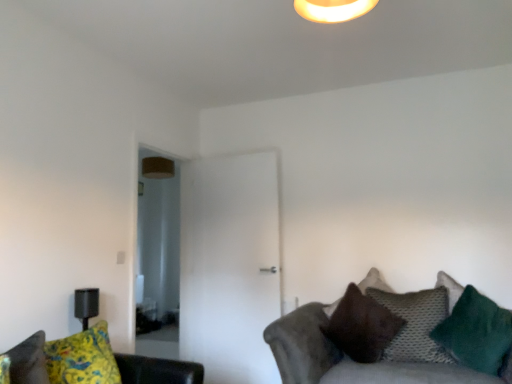
Question: Looking at their shapes, would you say textured gray couch at lower right, the first studio couch viewed from the right, is wider or thinner than yellow fabric couch at lower left, marked as the 2th studio couch in a right-to-left arrangement?

Choices:
 (A) thin
 (B) wide

Answer: (B)

Question: Would you say textured gray couch at lower right, the first studio couch viewed from the right, is to the left or to the right of yellow fabric couch at lower left, which is the first studio couch in left-to-right order, in the picture?

Choices:
 (A) right
 (B) left

Answer: (A)

Question: Which is farther from the textured gray couch at lower right, the first studio couch viewed from the right?

Choices:
 (A) knitted gray pillow at lower right, which appears as the second pillow when viewed from the back
 (B) yellow fabric couch at lower left, marked as the 2th studio couch in a right-to-left arrangement
 (C) green fuzzy pillow at right, the 1th pillow viewed from the front
 (D) brown suede pillow at lower right, placed as the 3th pillow when sorted from front to back

Answer: (B)

Question: Which object is the farthest from the brown suede pillow at lower right, which is counted as the 1th pillow, starting from the back?

Choices:
 (A) green fuzzy pillow at right, acting as the third pillow starting from the back
 (B) textured gray couch at lower right, which is the second studio couch in left-to-right order
 (C) knitted gray pillow at lower right, which appears as the second pillow when viewed from the back
 (D) yellow fabric couch at lower left, marked as the 2th studio couch in a right-to-left arrangement

Answer: (D)